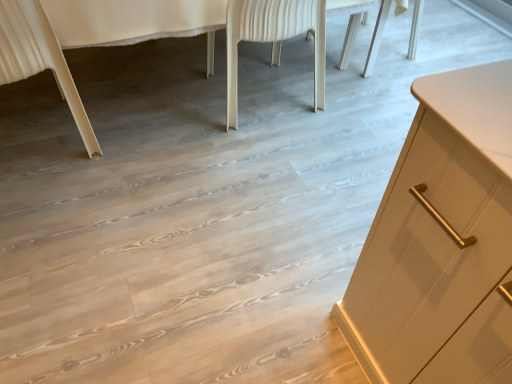
Question: Does light beige wood chair leg at lower left, which is counted as the 2th chair, starting from the right, come in front of white wood chair at center, marked as the 1th chair in a right-to-left arrangement?

Choices:
 (A) yes
 (B) no

Answer: (A)

Question: Does light beige wood chair leg at lower left, placed as the 1th chair when sorted from left to right, have a larger size compared to white wood chair at center, marked as the 1th chair in a right-to-left arrangement?

Choices:
 (A) yes
 (B) no

Answer: (B)

Question: Is light beige wood chair leg at lower left, placed as the 1th chair when sorted from left to right, completely or partially outside of white wood chair at center, which appears as the second chair when viewed from the left?

Choices:
 (A) no
 (B) yes

Answer: (B)

Question: Does light beige wood chair leg at lower left, placed as the 1th chair when sorted from left to right, have a lesser width compared to white wood chair at center, marked as the 1th chair in a right-to-left arrangement?

Choices:
 (A) no
 (B) yes

Answer: (B)

Question: From the image's perspective, does light beige wood chair leg at lower left, which is counted as the 2th chair, starting from the right, appear lower than white wood chair at center, marked as the 1th chair in a right-to-left arrangement?

Choices:
 (A) no
 (B) yes

Answer: (B)

Question: Looking at the image, does white wood chair at center, which appears as the second chair when viewed from the left, seem bigger or smaller compared to light beige wood chair leg at lower left, which is counted as the 2th chair, starting from the right?

Choices:
 (A) big
 (B) small

Answer: (A)

Question: From a real-world perspective, relative to light beige wood chair leg at lower left, placed as the 1th chair when sorted from left to right, is white wood chair at center, which appears as the second chair when viewed from the left, vertically above or below?

Choices:
 (A) below
 (B) above

Answer: (A)

Question: In the image, is white wood chair at center, marked as the 1th chair in a right-to-left arrangement, positioned in front of or behind light beige wood chair leg at lower left, which is counted as the 2th chair, starting from the right?

Choices:
 (A) behind
 (B) front

Answer: (A)

Question: Considering the positions of point (230, 41) and point (62, 92), is point (230, 41) closer or farther from the camera than point (62, 92)?

Choices:
 (A) closer
 (B) farther

Answer: (B)

Question: Is point (275, 18) closer or farther from the camera than point (416, 24)?

Choices:
 (A) farther
 (B) closer

Answer: (B)

Question: Is white wood chair at center, which appears as the second chair when viewed from the left, in front of or behind white glossy cabinet at right in the image?

Choices:
 (A) behind
 (B) front

Answer: (A)

Question: In the image, is white wood chair at center, which appears as the second chair when viewed from the left, on the left side or the right side of white glossy cabinet at right?

Choices:
 (A) left
 (B) right

Answer: (B)

Question: Would you say white wood chair at center, marked as the 1th chair in a right-to-left arrangement, is inside or outside white glossy cabinet at right?

Choices:
 (A) outside
 (B) inside

Answer: (B)

Question: Considering their positions, is light beige wood chair leg at lower left, placed as the 1th chair when sorted from left to right, located in front of or behind white wood chair at center, which appears as the second chair when viewed from the left?

Choices:
 (A) front
 (B) behind

Answer: (A)

Question: From the image's perspective, is light beige wood chair leg at lower left, which is counted as the 2th chair, starting from the right, located above or below white wood chair at center, marked as the 1th chair in a right-to-left arrangement?

Choices:
 (A) below
 (B) above

Answer: (A)